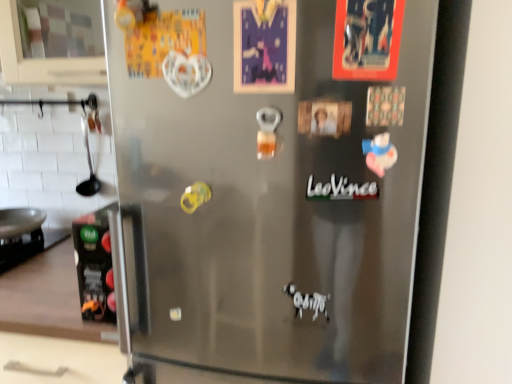
Locate an element on the screen. The width and height of the screenshot is (512, 384). black matte text at center is located at coordinates (340, 189).

Describe the element at coordinates (271, 180) in the screenshot. I see `satin silver fridge at center` at that location.

Where is `black matte text at center`? This screenshot has width=512, height=384. black matte text at center is located at coordinates tap(340, 189).

Is black matte carton at left inside the boundaries of black matte text at center, or outside?

black matte carton at left exists outside the volume of black matte text at center.

Is black matte carton at left smaller than black matte text at center?

Actually, black matte carton at left might be larger than black matte text at center.

From a real-world perspective, is black matte carton at left positioned above or below black matte text at center?

Clearly, from a real-world perspective, black matte carton at left is below black matte text at center.

Is the surface of black matte carton at left in direct contact with black matte text at center?

black matte carton at left and black matte text at center are not in contact.

Between black matte text at center and satin silver fridge at center, which one has smaller width?

Thinner between the two is black matte text at center.

Is black matte text at center next to satin silver fridge at center?

No, black matte text at center is not with satin silver fridge at center.

Could you tell me if black matte text at center is facing satin silver fridge at center?

Yes, black matte text at center is aimed at satin silver fridge at center.

Between satin silver fridge at center and black matte carton at left, which one has larger width?

With larger width is black matte carton at left.

Is satin silver fridge at center at the left side of black matte carton at left?

No, satin silver fridge at center is not to the left of black matte carton at left.

Between satin silver fridge at center and black matte text at center, which one is positioned behind?

black matte text at center is behind.

Which object is positioned more to the right, satin silver fridge at center or black matte text at center?

Positioned to the right is black matte text at center.

From the image's perspective, relative to satin silver fridge at center, is black matte carton at left above or below?

Based on their image positions, black matte carton at left is located beneath satin silver fridge at center.

Which is behind, black matte carton at left or satin silver fridge at center?

black matte carton at left.

Who is bigger, black matte carton at left or satin silver fridge at center?

satin silver fridge at center is bigger.

Is black matte text at center oriented away from black matte carton at left?

black matte text at center is not turned away from black matte carton at left.

Is the depth of black matte text at center less than that of black matte carton at left?

Yes, it is.

Based on their positions, is black matte text at center located to the left or right of black matte carton at left?

Clearly, black matte text at center is on the right of black matte carton at left in the image.

Is black matte text at center far away from black matte carton at left?

black matte text at center is actually quite close to black matte carton at left.

Identify the location of appliance on the left of black matte text at center. (95, 265).

At what (x,y) coordinates should I click in order to perform the action: click on refrigerator in front of the black matte text at center. Please return your answer as a coordinate pair (x, y). The height and width of the screenshot is (384, 512). Looking at the image, I should click on (271, 180).

Estimate the real-world distances between objects in this image. Which object is closer to satin silver fridge at center, black matte carton at left or black matte text at center?

The object closer to satin silver fridge at center is black matte carton at left.

Looking at the image, which one is located closer to black matte text at center, black matte carton at left or satin silver fridge at center?

black matte carton at left lies closer to black matte text at center than the other object.

Looking at the image, which one is located closer to black matte carton at left, black matte text at center or satin silver fridge at center?

Based on the image, black matte text at center appears to be nearer to black matte carton at left.

Considering their positions, is satin silver fridge at center positioned further to black matte carton at left than black matte text at center?

The object further to black matte carton at left is satin silver fridge at center.

Considering their positions, is black matte text at center positioned closer to satin silver fridge at center than black matte carton at left?

black matte carton at left is positioned closer to the anchor satin silver fridge at center.

Based on their spatial positions, is satin silver fridge at center or black matte carton at left further from black matte text at center?

satin silver fridge at center.

Identify the location of refrigerator between black matte carton at left and black matte text at center. (271, 180).